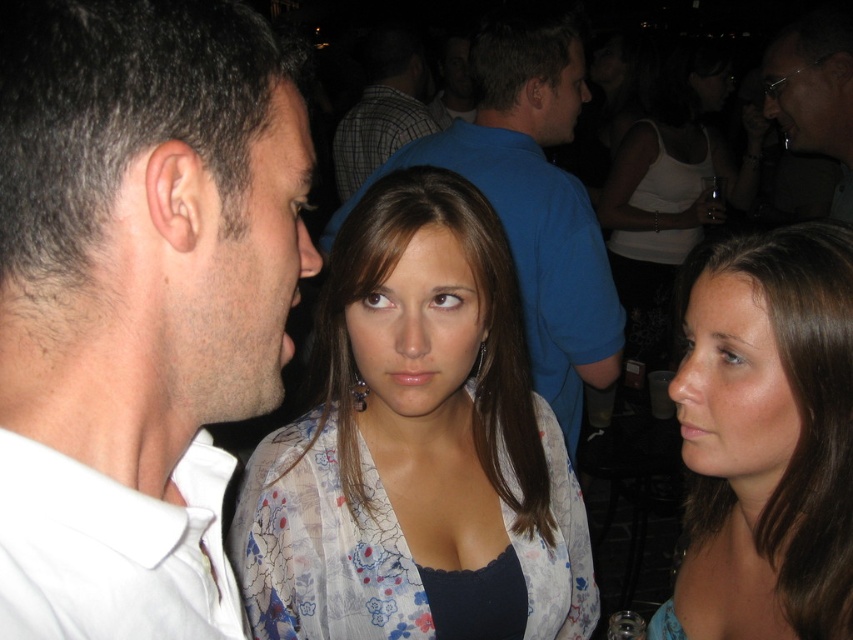
Question: Which of the following is the closest to the observer?

Choices:
 (A) (848, 200)
 (B) (674, 593)

Answer: (B)

Question: Among these objects, which one is farthest from the camera?

Choices:
 (A) plaid shirt at center
 (B) blue cotton shirt at center

Answer: (A)

Question: Can you confirm if floral sheer blouse at center is smaller than blue cotton shirt at center?

Choices:
 (A) yes
 (B) no

Answer: (A)

Question: Is white matte tank top at upper center bigger than sunglasses at upper right?

Choices:
 (A) yes
 (B) no

Answer: (A)

Question: Which point is closer to the camera taking this photo?

Choices:
 (A) (849, 497)
 (B) (840, 42)

Answer: (A)

Question: Does white matte shirt at center have a larger size compared to brown hair at center?

Choices:
 (A) yes
 (B) no

Answer: (B)